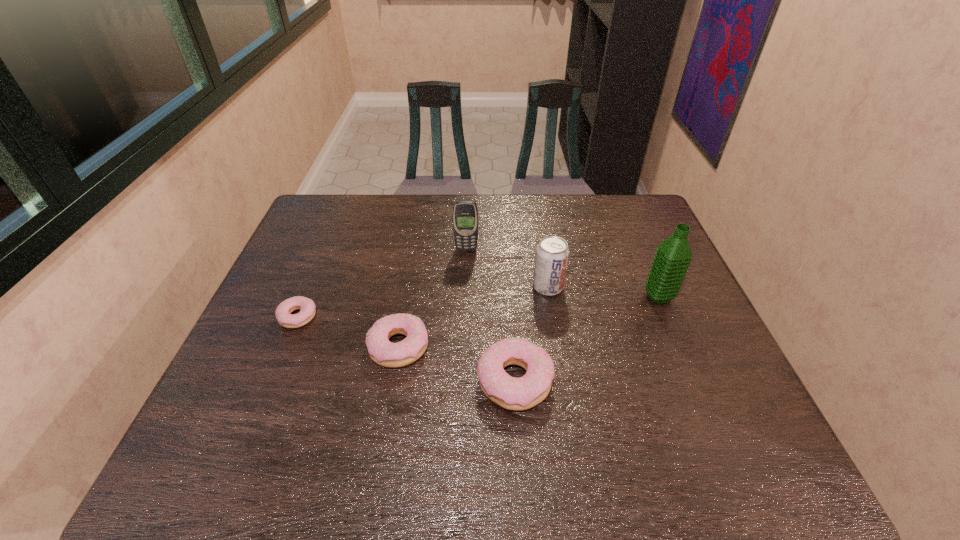
I want to click on the leftmost doughnut, so click(307, 307).

I want to click on the leftmost object, so click(307, 307).

Where is `the fifth tallest object`? The width and height of the screenshot is (960, 540). the fifth tallest object is located at coordinates (383, 352).

Where is `the second object from left to right`? This screenshot has width=960, height=540. the second object from left to right is located at coordinates pos(383,352).

Where is `the rightmost doughnut`? Image resolution: width=960 pixels, height=540 pixels. the rightmost doughnut is located at coordinates (525, 392).

Where is `the tallest object`? This screenshot has height=540, width=960. the tallest object is located at coordinates (673, 256).

Identify the location of the rightmost object. The image size is (960, 540). (673, 256).

I want to click on the farthest object, so click(465, 213).

The height and width of the screenshot is (540, 960). I want to click on the third tallest object, so click(x=552, y=253).

The image size is (960, 540). What are the coordinates of `vacant space located on the back of the shortest doughnut` in the screenshot? It's located at (335, 227).